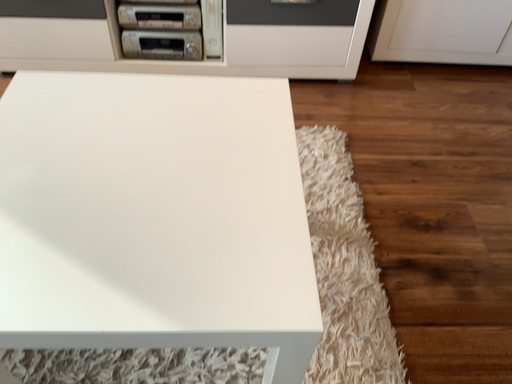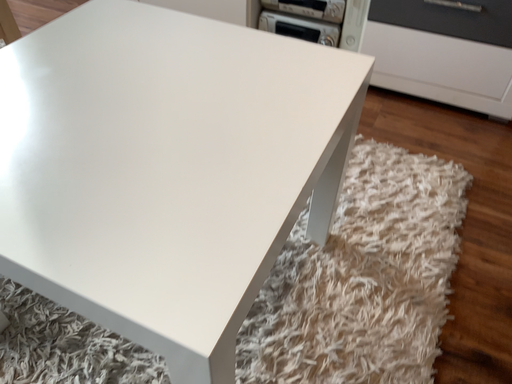
Question: Which way did the camera rotate in the video?

Choices:
 (A) rotated right
 (B) rotated left

Answer: (B)